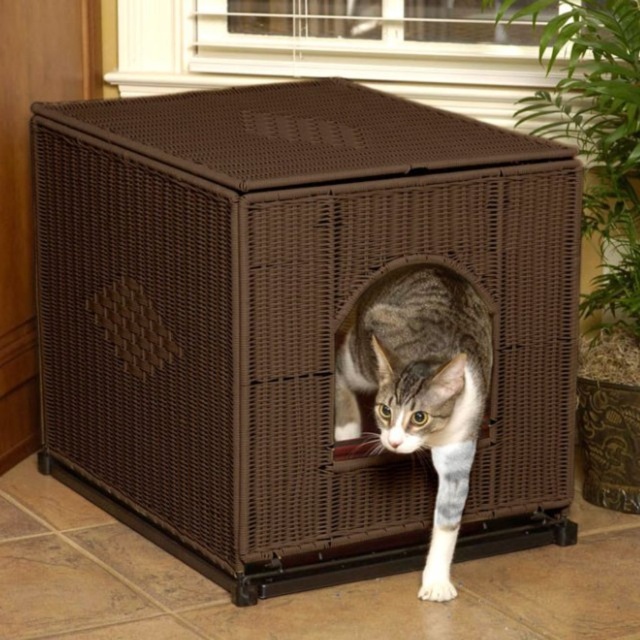
Question: Which of the following is the farthest from the observer?

Choices:
 (A) (394, 296)
 (B) (132, 330)

Answer: (B)

Question: Is brown wicker crate at center thinner than tabby fur cat at center?

Choices:
 (A) yes
 (B) no

Answer: (B)

Question: Is brown wicker crate at center below tabby fur cat at center?

Choices:
 (A) yes
 (B) no

Answer: (B)

Question: Among these objects, which one is nearest to the camera?

Choices:
 (A) tabby fur cat at center
 (B) brown wicker crate at center

Answer: (A)

Question: Does brown wicker crate at center have a greater width compared to tabby fur cat at center?

Choices:
 (A) no
 (B) yes

Answer: (B)